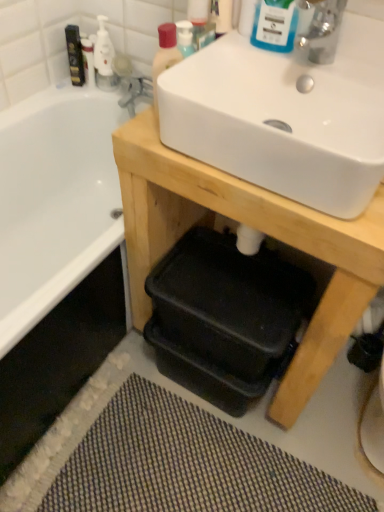
Image resolution: width=384 pixels, height=512 pixels. I want to click on vacant area that is situated to the right of silver metallic faucet at upper right, so click(356, 71).